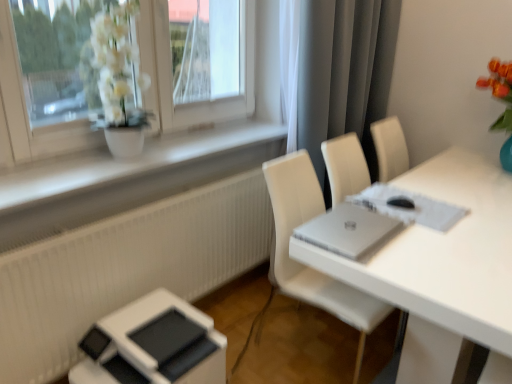
Question: Considering the relative positions of white glossy table at center and gray matte curtain at upper right in the image provided, is white glossy table at center to the left of gray matte curtain at upper right from the viewer's perspective?

Choices:
 (A) yes
 (B) no

Answer: (B)

Question: Can you confirm if white glossy table at center is wider than gray matte curtain at upper right?

Choices:
 (A) yes
 (B) no

Answer: (A)

Question: Does white glossy table at center touch gray matte curtain at upper right?

Choices:
 (A) no
 (B) yes

Answer: (A)

Question: Considering the relative sizes of white glossy table at center and gray matte curtain at upper right in the image provided, is white glossy table at center shorter than gray matte curtain at upper right?

Choices:
 (A) yes
 (B) no

Answer: (A)

Question: Does white glossy table at center appear on the right side of gray matte curtain at upper right?

Choices:
 (A) yes
 (B) no

Answer: (A)

Question: Considering the relative sizes of white glossy table at center and gray matte curtain at upper right in the image provided, is white glossy table at center taller than gray matte curtain at upper right?

Choices:
 (A) yes
 (B) no

Answer: (B)

Question: Is white glossy table at center thinner than white matte window sill at upper left?

Choices:
 (A) no
 (B) yes

Answer: (A)

Question: Does white glossy table at center have a lesser height compared to white matte window sill at upper left?

Choices:
 (A) no
 (B) yes

Answer: (A)

Question: Considering the relative positions of white glossy table at center and white matte window sill at upper left in the image provided, is white glossy table at center to the left of white matte window sill at upper left from the viewer's perspective?

Choices:
 (A) yes
 (B) no

Answer: (B)

Question: Is white glossy table at center taller than white matte window sill at upper left?

Choices:
 (A) no
 (B) yes

Answer: (B)

Question: Does white glossy table at center appear on the right side of white matte window sill at upper left?

Choices:
 (A) yes
 (B) no

Answer: (A)

Question: Is white glossy table at center positioned with its back to white matte window sill at upper left?

Choices:
 (A) no
 (B) yes

Answer: (A)

Question: From a real-world perspective, is white matte window sill at upper left located higher than gray matte curtain at upper right?

Choices:
 (A) no
 (B) yes

Answer: (A)